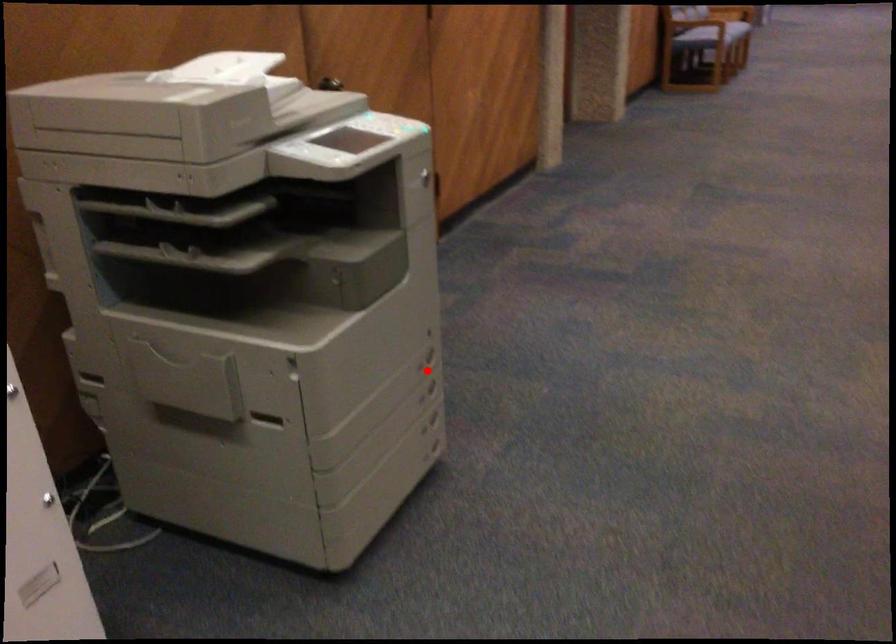
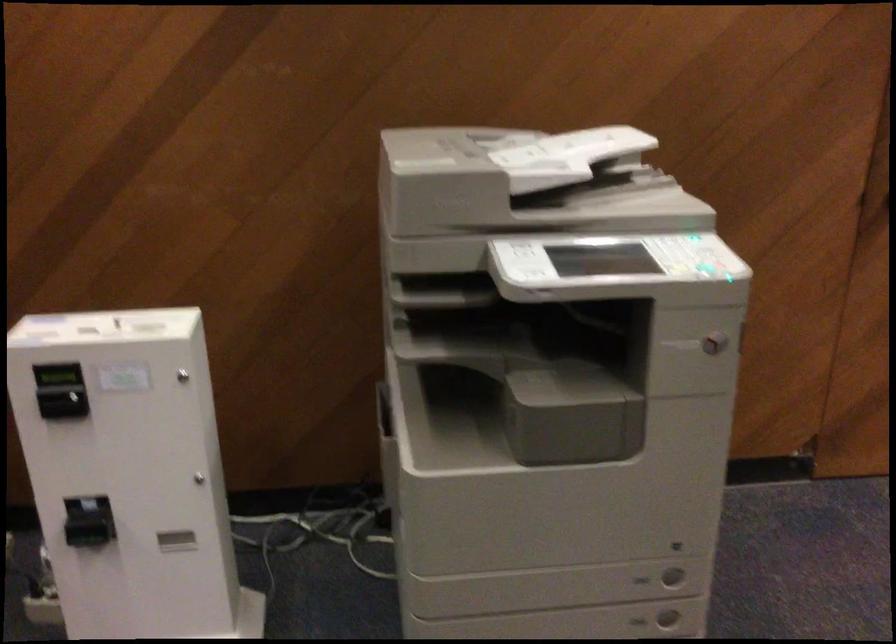
Question: I am providing you with two images of the same scene from different viewpoints. A red point is shown in image1. For the corresponding object point in image2, is it positioned nearer or farther from the camera?

Choices:
 (A) Nearer
 (B) Farther

Answer: (A)